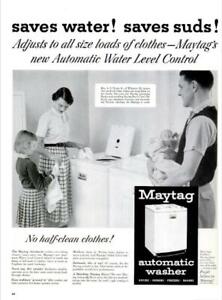
Where is `washing machine`? washing machine is located at coordinates (166, 235).